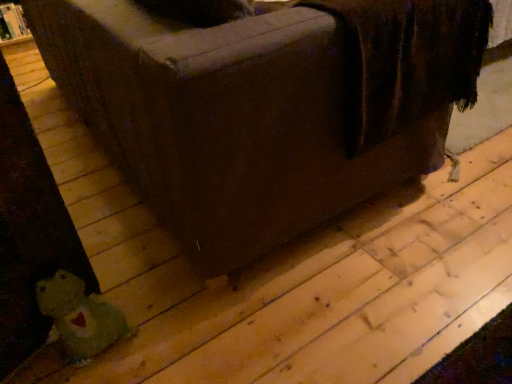
Locate an element on the screen. Image resolution: width=512 pixels, height=384 pixels. vacant space behind green plush toy at lower left is located at coordinates (128, 282).